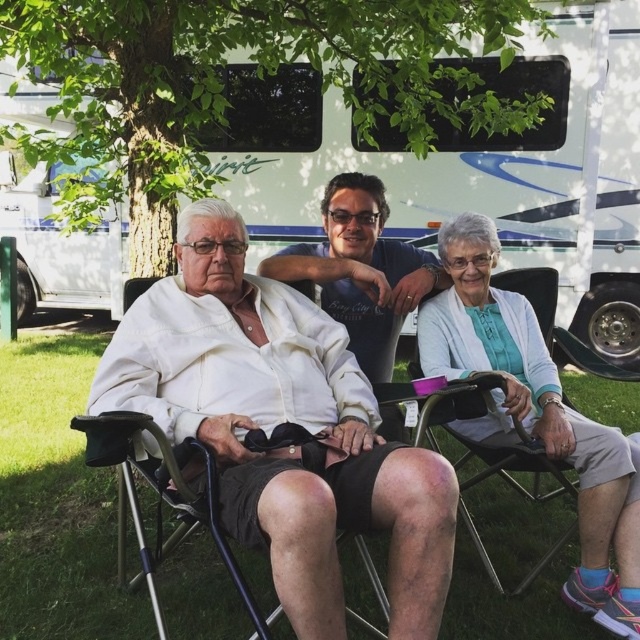
Question: Where is white textured cardigan at lower right located in relation to white matte shirt at center in the image?

Choices:
 (A) above
 (B) below

Answer: (B)

Question: Is white matte shirt at center smaller than metallic folding chair at center?

Choices:
 (A) yes
 (B) no

Answer: (B)

Question: Can you confirm if white cotton shirt at center is wider than white glossy recreational vehicle at upper center?

Choices:
 (A) yes
 (B) no

Answer: (A)

Question: Considering the real-world distances, which object is closest to the white matte shirt at center?

Choices:
 (A) white textured cardigan at lower right
 (B) white cotton shirt at center
 (C) metallic folding chair at center
 (D) white glossy recreational vehicle at upper center

Answer: (B)

Question: Based on their relative distances, which object is farther from the white textured cardigan at lower right?

Choices:
 (A) white glossy recreational vehicle at upper center
 (B) white matte shirt at center
 (C) white cotton shirt at center
 (D) metallic folding chair at center

Answer: (A)

Question: Based on their relative distances, which object is nearer to the white matte shirt at center?

Choices:
 (A) metallic folding chair at center
 (B) white textured cardigan at lower right
 (C) white glossy recreational vehicle at upper center

Answer: (B)